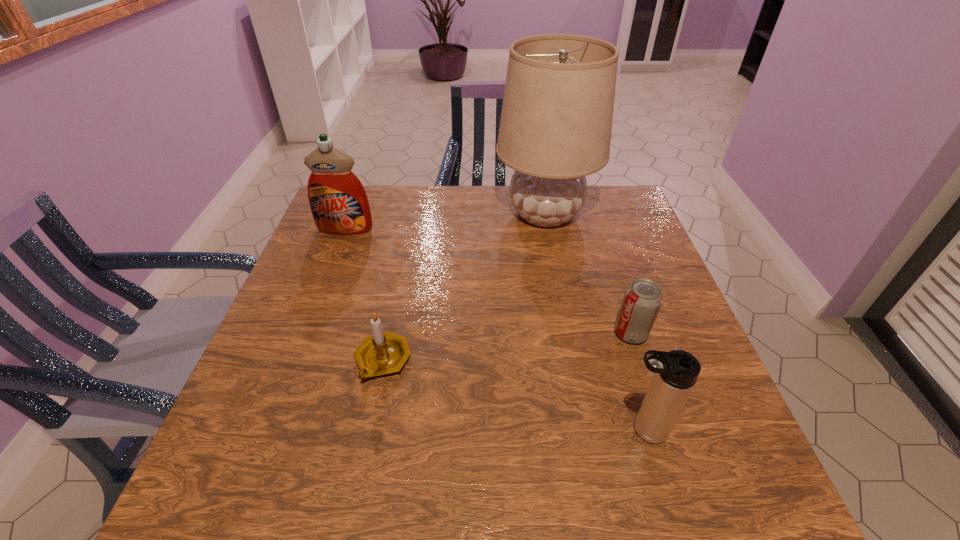
Where is `object at the far left corner`? The height and width of the screenshot is (540, 960). object at the far left corner is located at coordinates (339, 204).

Identify the location of object at the far right corner. Image resolution: width=960 pixels, height=540 pixels. (556, 121).

At what (x,y) coordinates should I click in order to perform the action: click on vacant space at the far edge of the desktop. Please return your answer as a coordinate pair (x, y). Looking at the image, I should click on (492, 211).

Locate an element on the screen. vacant region at the left edge of the desktop is located at coordinates (298, 448).

In the image, there is a desktop. At what (x,y) coordinates should I click in order to perform the action: click on vacant space at the right edge. Please return your answer as a coordinate pair (x, y). Looking at the image, I should click on (616, 268).

The image size is (960, 540). In order to click on vacant area at the far right corner in this screenshot , I will do `click(612, 221)`.

Where is `vacant area at the near right corner`? vacant area at the near right corner is located at coordinates (752, 503).

Find the location of a particular element. The image size is (960, 540). empty space between the soda can and the third shortest object is located at coordinates (636, 382).

At what (x,y) coordinates should I click in order to perform the action: click on unoccupied position between the thermos bottle and the lampshade. Please return your answer as a coordinate pair (x, y). The height and width of the screenshot is (540, 960). Looking at the image, I should click on (593, 322).

Identify the location of free spot between the lampshade and the candle holder. Image resolution: width=960 pixels, height=540 pixels. (464, 287).